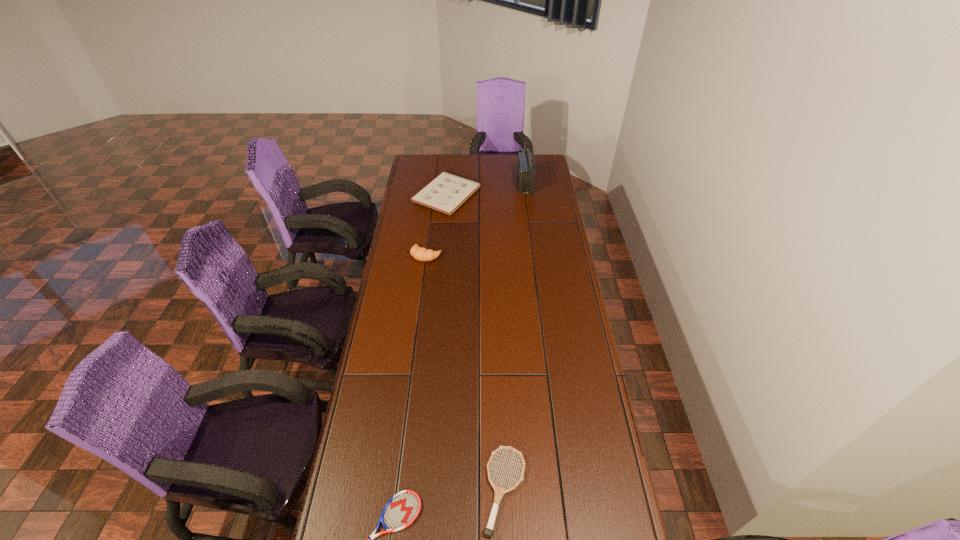
In the image, there is a desktop. Identify the location of vacant region at the far edge. The width and height of the screenshot is (960, 540). (515, 160).

Where is `vacant space at the left edge of the desktop`? This screenshot has width=960, height=540. vacant space at the left edge of the desktop is located at coordinates [x=400, y=340].

Find the location of `free space at the right edge of the desktop`. free space at the right edge of the desktop is located at coordinates (587, 361).

This screenshot has height=540, width=960. I want to click on unoccupied area between the taller tennis racket and the notepad, so click(476, 342).

Locate an element on the screen. The width and height of the screenshot is (960, 540). free point between the third tallest object and the second tallest object is located at coordinates (437, 225).

The height and width of the screenshot is (540, 960). In order to click on vacant space that is in between the radio receiver and the notepad in this screenshot , I will do `click(486, 189)`.

Locate an element on the screen. free space between the right tennis racket and the third farthest object is located at coordinates (466, 373).

What are the coordinates of `vacant area that lies between the third nearest object and the notepad` in the screenshot? It's located at (437, 225).

Locate an element on the screen. The width and height of the screenshot is (960, 540). object that stands as the closest to the third tallest object is located at coordinates (525, 171).

Select which object appears as the closest to the second shortest object. Please provide its 2D coordinates. Your answer should be formatted as a tuple, i.e. [(x, y)], where the tuple contains the x and y coordinates of a point satisfying the conditions above.

[(403, 508)]